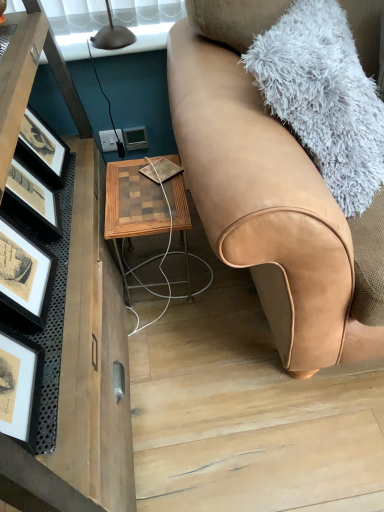
Question: Is woodenmaterial/texturetable at center outside of tan leather couch at right?

Choices:
 (A) no
 (B) yes

Answer: (B)

Question: From a real-world perspective, does woodenmaterial/texturetable at center stand above tan leather couch at right?

Choices:
 (A) yes
 (B) no

Answer: (B)

Question: Is woodenmaterial/texturetable at center surrounding tan leather couch at right?

Choices:
 (A) yes
 (B) no

Answer: (B)

Question: Is woodenmaterial/texturetable at center in contact with tan leather couch at right?

Choices:
 (A) no
 (B) yes

Answer: (A)

Question: Is woodenmaterial/texturetable at center further to camera compared to tan leather couch at right?

Choices:
 (A) yes
 (B) no

Answer: (A)

Question: Is woodenmaterial/texturetable at center aimed at tan leather couch at right?

Choices:
 (A) no
 (B) yes

Answer: (A)

Question: Does tan leather couch at right have a larger size compared to woodenmaterial/texturetable at center?

Choices:
 (A) yes
 (B) no

Answer: (A)

Question: Does tan leather couch at right appear on the right side of woodenmaterial/texturetable at center?

Choices:
 (A) yes
 (B) no

Answer: (A)

Question: Does tan leather couch at right have a lesser height compared to woodenmaterial/texturetable at center?

Choices:
 (A) no
 (B) yes

Answer: (A)

Question: Can you confirm if tan leather couch at right is wider than woodenmaterial/texturetable at center?

Choices:
 (A) yes
 (B) no

Answer: (A)

Question: From the image's perspective, is tan leather couch at right beneath woodenmaterial/texturetable at center?

Choices:
 (A) yes
 (B) no

Answer: (B)

Question: Considering the relative positions of tan leather couch at right and woodenmaterial/texturetable at center in the image provided, is tan leather couch at right in front of woodenmaterial/texturetable at center?

Choices:
 (A) yes
 (B) no

Answer: (A)

Question: Is matte gray thermostat at center behind tan leather couch at right?

Choices:
 (A) no
 (B) yes

Answer: (B)